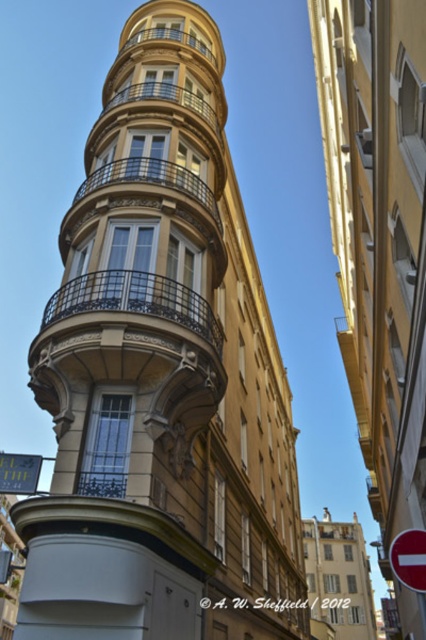
This screenshot has width=426, height=640. What do you see at coordinates (135, 301) in the screenshot?
I see `black wrought iron balcony at upper left` at bounding box center [135, 301].

Locate an element on the screen. The image size is (426, 640). black wrought iron balcony at upper left is located at coordinates (135, 301).

Where is `black wrought iron balcony at upper left`? This screenshot has width=426, height=640. black wrought iron balcony at upper left is located at coordinates (135, 301).

What are the coordinates of `black wrought iron balcony at upper left` in the screenshot? It's located at (135, 301).

Can you confirm if golden stone tower at center is thinner than red plastic traffic sign at upper right?

In fact, golden stone tower at center might be wider than red plastic traffic sign at upper right.

Which of these two, golden stone tower at center or red plastic traffic sign at upper right, stands taller?

golden stone tower at center is taller.

Identify the location of golden stone tower at center. The height and width of the screenshot is (640, 426). (161, 376).

Based on the photo, which is more to the right, golden stone tower at center or green reflective sign at center?

golden stone tower at center is more to the right.

Between point (189, 33) and point (14, 456), which one is positioned in front?

Point (14, 456) is more forward.

Where is `golden stone tower at center`? golden stone tower at center is located at coordinates (161, 376).